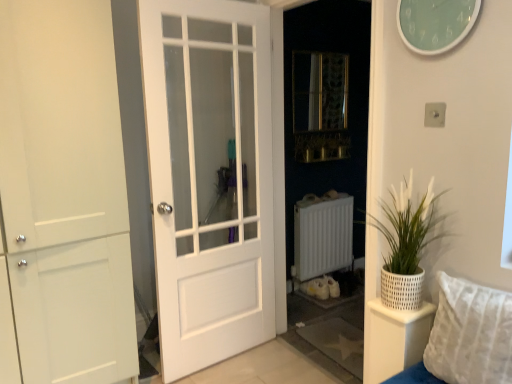
Question: Considering the positions of point (425, 46) and point (96, 233), is point (425, 46) closer or farther from the camera than point (96, 233)?

Choices:
 (A) closer
 (B) farther

Answer: (A)

Question: In the image, is teal glass clock at upper right positioned in front of or behind white matte door at left, which ranks as the second door in right-to-left order?

Choices:
 (A) front
 (B) behind

Answer: (A)

Question: Which of these objects is positioned farthest from the white textured pillow at lower right?

Choices:
 (A) teal glass clock at upper right
 (B) white woven basket at right
 (C) metallic mesh at center
 (D) white matte door at left, marked as the 1th door in a left-to-right arrangement
 (E) white textured pot at right

Answer: (C)

Question: Which object is the closest to the teal glass clock at upper right?

Choices:
 (A) white matte door at left, which ranks as the second door in right-to-left order
 (B) metallic mesh at center
 (C) white glass door at center, the 1th door when ordered from right to left
 (D) white woven basket at right
 (E) white matte radiator at center

Answer: (D)